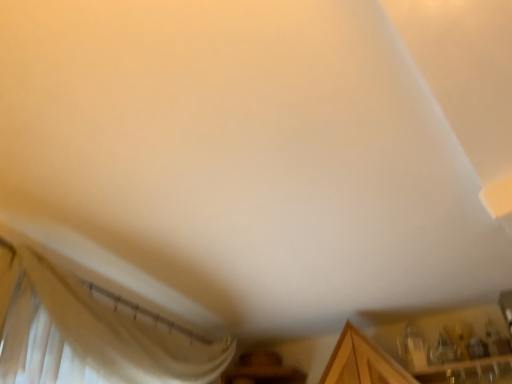
In order to face wooden cabinet at lower right, should I rotate leftwards or rightwards?

It's best to rotate right around 26.493 degrees.

Describe the element at coordinates (445, 343) in the screenshot. The height and width of the screenshot is (384, 512). I see `wooden cabinet at lower right` at that location.

The height and width of the screenshot is (384, 512). Identify the location of wooden cabinet at lower right. (445, 343).

In order to face white sheer curtain at lower left, should I rotate leftwards or rightwards?

You should rotate left by 13.259 degrees.

This screenshot has width=512, height=384. What do you see at coordinates (95, 337) in the screenshot?
I see `white sheer curtain at lower left` at bounding box center [95, 337].

Identify the location of white sheer curtain at lower left. This screenshot has width=512, height=384. [x=95, y=337].

Image resolution: width=512 pixels, height=384 pixels. I want to click on wooden cabinet at lower right, so click(x=445, y=343).

Which is more to the right, wooden cabinet at lower right or white sheer curtain at lower left?

Positioned to the right is wooden cabinet at lower right.

Is wooden cabinet at lower right in front of or behind white sheer curtain at lower left in the image?

Clearly, wooden cabinet at lower right is behind white sheer curtain at lower left.

Is point (400, 358) closer to viewer compared to point (134, 370)?

No.

From the image's perspective, relative to white sheer curtain at lower left, is wooden cabinet at lower right above or below?

wooden cabinet at lower right is situated lower than white sheer curtain at lower left in the image.

From a real-world perspective, between wooden cabinet at lower right and white sheer curtain at lower left, who is vertically lower?

In real-world perspective, white sheer curtain at lower left is lower.

Is wooden cabinet at lower right wider or thinner than white sheer curtain at lower left?

Clearly, wooden cabinet at lower right has more width compared to white sheer curtain at lower left.

Considering the sizes of wooden cabinet at lower right and white sheer curtain at lower left in the image, is wooden cabinet at lower right taller or shorter than white sheer curtain at lower left?

Clearly, wooden cabinet at lower right is shorter compared to white sheer curtain at lower left.

Can you confirm if wooden cabinet at lower right is smaller than white sheer curtain at lower left?

Indeed, wooden cabinet at lower right has a smaller size compared to white sheer curtain at lower left.

Choose the correct answer: Is wooden cabinet at lower right inside white sheer curtain at lower left or outside it?

wooden cabinet at lower right cannot be found inside white sheer curtain at lower left.

Would you say wooden cabinet at lower right is a long distance from white sheer curtain at lower left?

Yes, wooden cabinet at lower right and white sheer curtain at lower left are located far from each other.

Is wooden cabinet at lower right aimed at white sheer curtain at lower left?

No, wooden cabinet at lower right does not turn towards white sheer curtain at lower left.

How distant is wooden cabinet at lower right from white sheer curtain at lower left?

4.61 feet.

I want to click on cabinetry below the white sheer curtain at lower left (from the image's perspective), so click(x=445, y=343).

Between white sheer curtain at lower left and wooden cabinet at lower right, which one appears on the right side from the viewer's perspective?

wooden cabinet at lower right.

Is white sheer curtain at lower left behind wooden cabinet at lower right?

No.

Based on the photo, which is farther from the camera, (121, 358) or (360, 368)?

Point (360, 368)

From the image's perspective, which is below, white sheer curtain at lower left or wooden cabinet at lower right?

wooden cabinet at lower right appears lower in the image.

From a real-world perspective, relative to wooden cabinet at lower right, is white sheer curtain at lower left vertically above or below?

white sheer curtain at lower left is situated lower than wooden cabinet at lower right in the real world.

Looking at their sizes, would you say white sheer curtain at lower left is wider or thinner than wooden cabinet at lower right?

In the image, white sheer curtain at lower left appears to be more narrow than wooden cabinet at lower right.

Which of these two, white sheer curtain at lower left or wooden cabinet at lower right, stands shorter?

wooden cabinet at lower right.

Can you confirm if white sheer curtain at lower left is smaller than wooden cabinet at lower right?

No.

Which is correct: white sheer curtain at lower left is inside wooden cabinet at lower right, or outside of it?

white sheer curtain at lower left is outside wooden cabinet at lower right.

Are white sheer curtain at lower left and wooden cabinet at lower right located far from each other?

Yes, white sheer curtain at lower left and wooden cabinet at lower right are quite far apart.

Does white sheer curtain at lower left turn towards wooden cabinet at lower right?

Yes.

Find the location of `cabinetry on the right of white sheer curtain at lower left`. cabinetry on the right of white sheer curtain at lower left is located at coordinates (445, 343).

Image resolution: width=512 pixels, height=384 pixels. Find the location of `cabinetry on the right of the white sheer curtain at lower left`. cabinetry on the right of the white sheer curtain at lower left is located at coordinates (445, 343).

Find the location of `curtain on the left side of wooden cabinet at lower right`. curtain on the left side of wooden cabinet at lower right is located at coordinates (95, 337).